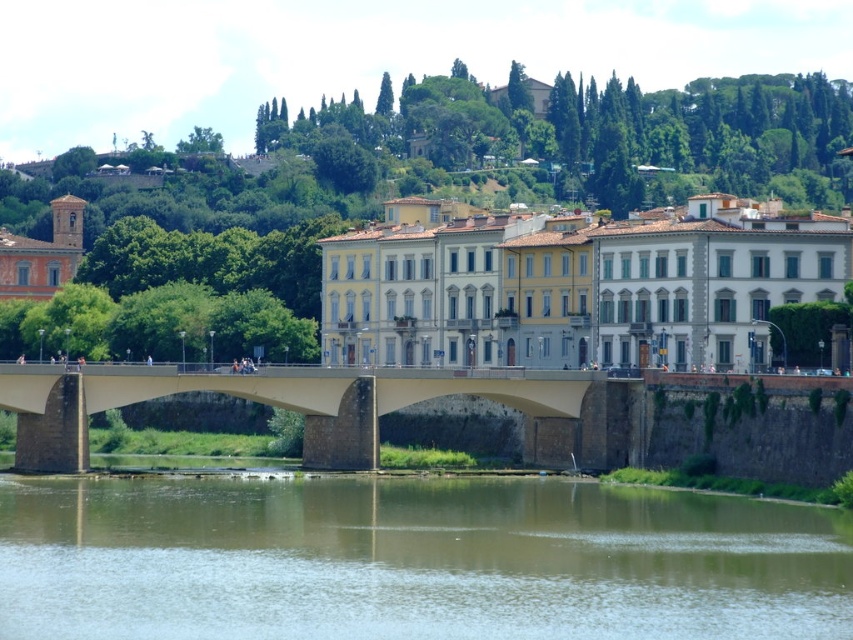
You are standing at the origin point of the image coordinate system. You want to walk to the brown sedimentary rock at lower center. What are the coordinates of the direction you should walk towards?

The coordinates of the direction you should walk towards are point [412,561].

You are a geologist examining the riverside scene. You notice the brown sedimentary rock at lower center and the concrete bridge at center. Which object is smaller in size?

The brown sedimentary rock at lower center is smaller in size compared to the concrete bridge at center.